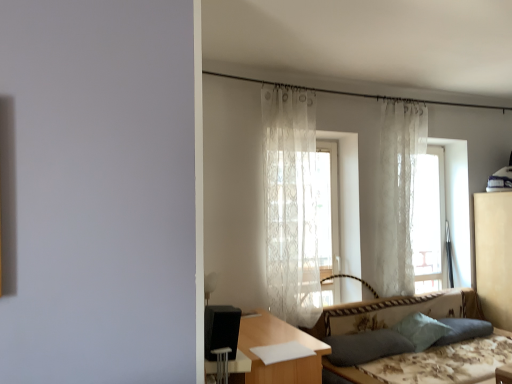
Question: Based on their sizes in the image, would you say translucent white curtain at center is bigger or smaller than beige fabric dresser at right?

Choices:
 (A) small
 (B) big

Answer: (A)

Question: From the image's perspective, is translucent white curtain at center located above or below beige fabric dresser at right?

Choices:
 (A) below
 (B) above

Answer: (B)

Question: Which is farther from the dark fabric pillow at lower right, placed as the 3th pillow when sorted from right to left?

Choices:
 (A) floral fabric couch at lower right
 (B) light blue fabric pillow at lower right, the 1th pillow when ordered from right to left
 (C) black matte speaker at lower left
 (D) beige fabric dresser at right
 (E) teal fabric pillow at lower right, marked as the 2th pillow in a right-to-left arrangement

Answer: (D)

Question: Which of these objects is positioned closest to the dark fabric pillow at lower right, marked as the first pillow in a left-to-right arrangement?

Choices:
 (A) sheer white curtain at center, the first curtain when ordered from front to back
 (B) light blue fabric pillow at lower right, acting as the third pillow starting from the left
 (C) black matte speaker at lower left
 (D) teal fabric pillow at lower right, marked as the 2th pillow in a right-to-left arrangement
 (E) floral fabric couch at lower right

Answer: (E)